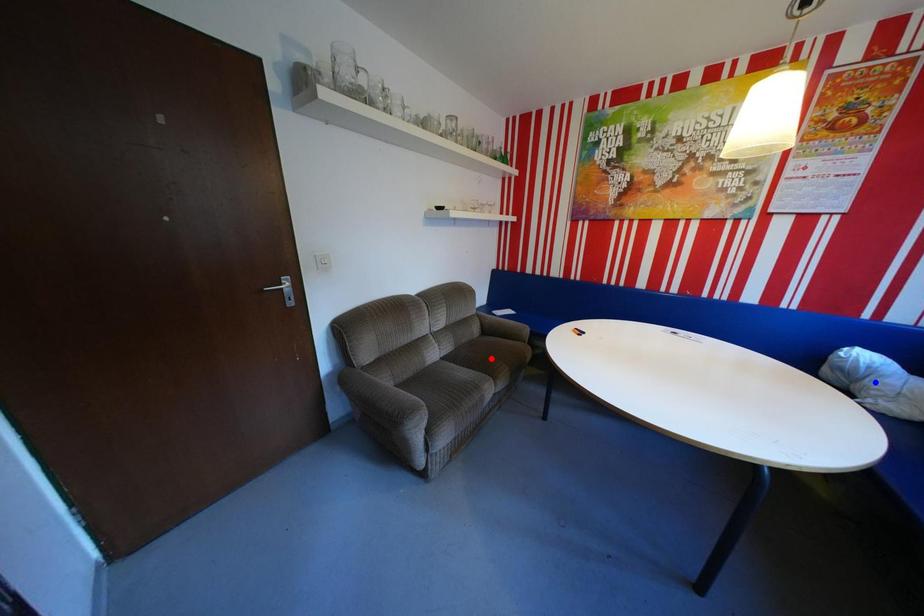
Question: Two points are marked on the image. Which point is closer to the camera?

Choices:
 (A) Blue point is closer.
 (B) Red point is closer.

Answer: (A)